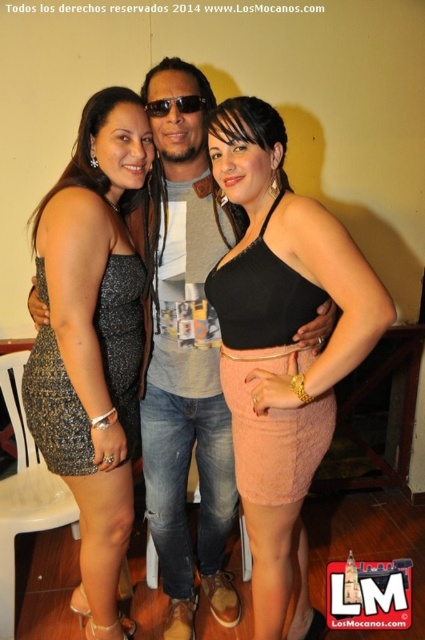
Question: Where is black fabric skirt at center located in relation to black plastic sunglasses at center in the image?

Choices:
 (A) right
 (B) left

Answer: (A)

Question: Which point appears closest to the camera in this image?

Choices:
 (A) (244, 488)
 (B) (70, 268)
 (C) (204, 589)

Answer: (B)

Question: Does sparkly silver dress at left appear on the right side of gray cotton t-shirt at center?

Choices:
 (A) no
 (B) yes

Answer: (A)

Question: Which point is closer to the camera?

Choices:
 (A) (166, 102)
 (B) (136, 269)
 (C) (243, 145)

Answer: (C)

Question: Which point is closer to the camera taking this photo?

Choices:
 (A) (288, 488)
 (B) (155, 108)
 (C) (127, 205)
 (D) (158, 278)

Answer: (A)

Question: Observing the image, what is the correct spatial positioning of gray cotton t-shirt at center in reference to black plastic sunglasses at center?

Choices:
 (A) above
 (B) below

Answer: (B)